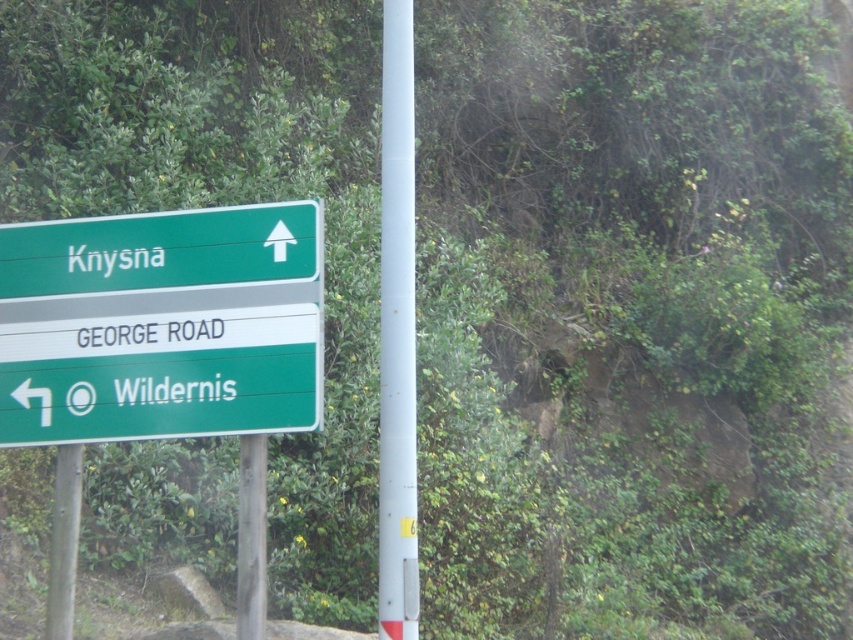
Question: Can you confirm if green plastic sign at left is thinner than green plastic sign at upper center?

Choices:
 (A) yes
 (B) no

Answer: (A)

Question: Can you confirm if green plastic sign at left is positioned above white metallic pole at center?

Choices:
 (A) no
 (B) yes

Answer: (A)

Question: Which of these objects is positioned closest to the metallic pole at lower left?

Choices:
 (A) green plastic sign at left
 (B) white metallic pole at center
 (C) green plastic sign at upper center

Answer: (A)

Question: Estimate the real-world distances between objects in this image. Which object is farther from the white metallic pole at center?

Choices:
 (A) metallic pole at center
 (B) green plastic sign at left

Answer: (B)

Question: Which object appears farthest from the camera in this image?

Choices:
 (A) metallic pole at lower left
 (B) green plastic sign at left
 (C) metallic pole at center
 (D) white metallic pole at center

Answer: (A)

Question: Can you confirm if green plastic sign at upper center is thinner than white metallic pole at center?

Choices:
 (A) yes
 (B) no

Answer: (B)